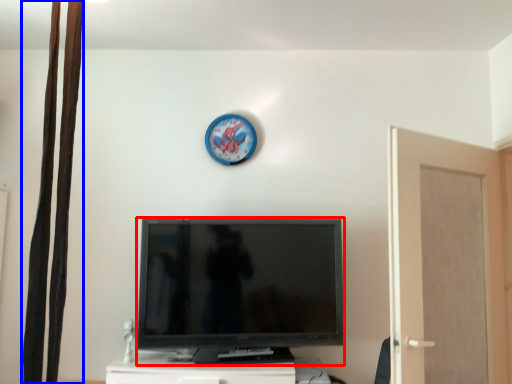
Question: Which object appears closest to the camera in this image, television (highlighted by a red box) or curtain (highlighted by a blue box)?

Choices:
 (A) television
 (B) curtain

Answer: (B)